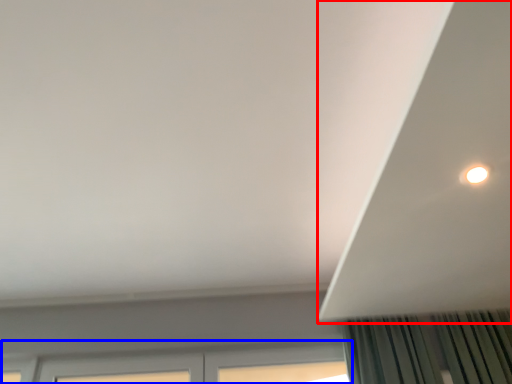
Question: Which object is further to the camera taking this photo, exhaust hood (highlighted by a red box) or window (highlighted by a blue box)?

Choices:
 (A) exhaust hood
 (B) window

Answer: (B)